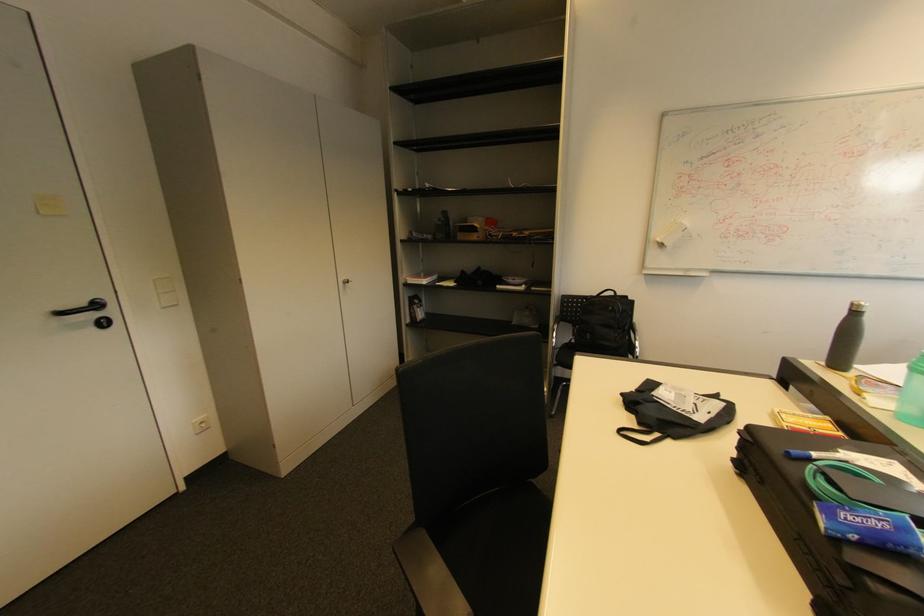
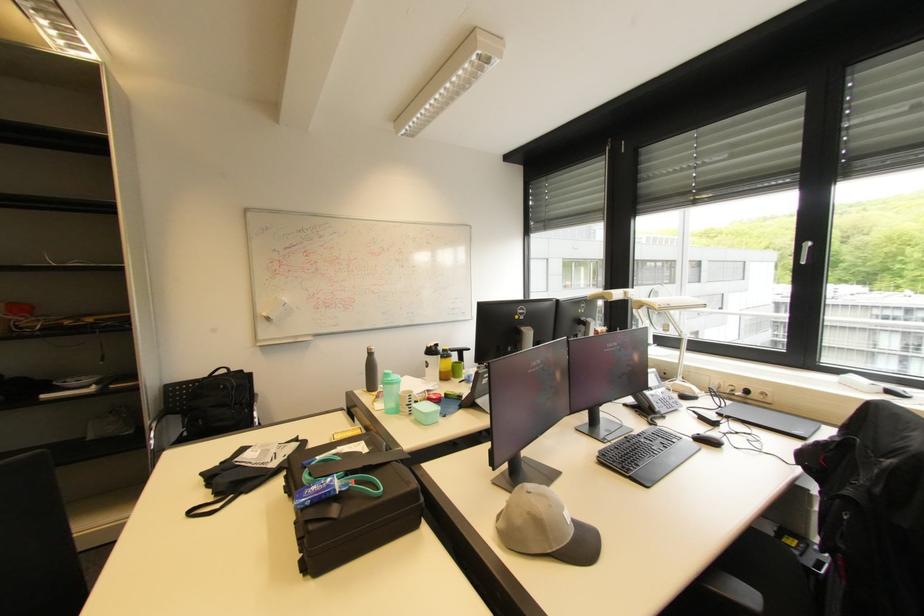
Question: The camera is either moving clockwise (left) or counter-clockwise (right) around the object. The first image is from the beginning of the video and the second image is from the end. Is the camera moving left or right when shooting the video?

Choices:
 (A) Left
 (B) Right

Answer: (A)